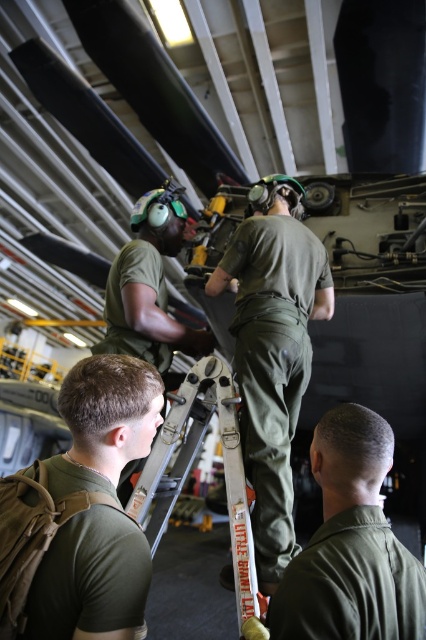
Who is higher up, green cotton pants at center or green uniform at center?

Positioned higher is green cotton pants at center.

Is green cotton pants at center below green uniform at center?

No, green cotton pants at center is not below green uniform at center.

Where is `green cotton pants at center`? green cotton pants at center is located at coordinates (273, 364).

Who is lower down, green matte t-shirt at lower left or white plastic ladder at center?

white plastic ladder at center is lower down.

Between point (127, 545) and point (242, 605), which one is positioned behind?

The point (242, 605) is behind.

Locate an element on the screen. The width and height of the screenshot is (426, 640). green matte t-shirt at lower left is located at coordinates (97, 506).

Does green uniform at center have a greater width compared to green matte uniform at center?

No.

Measure the distance between point (x=333, y=636) and camera.

The distance of point (x=333, y=636) from camera is 34.32 inches.

Where is `green uniform at center`? The width and height of the screenshot is (426, 640). green uniform at center is located at coordinates (351, 545).